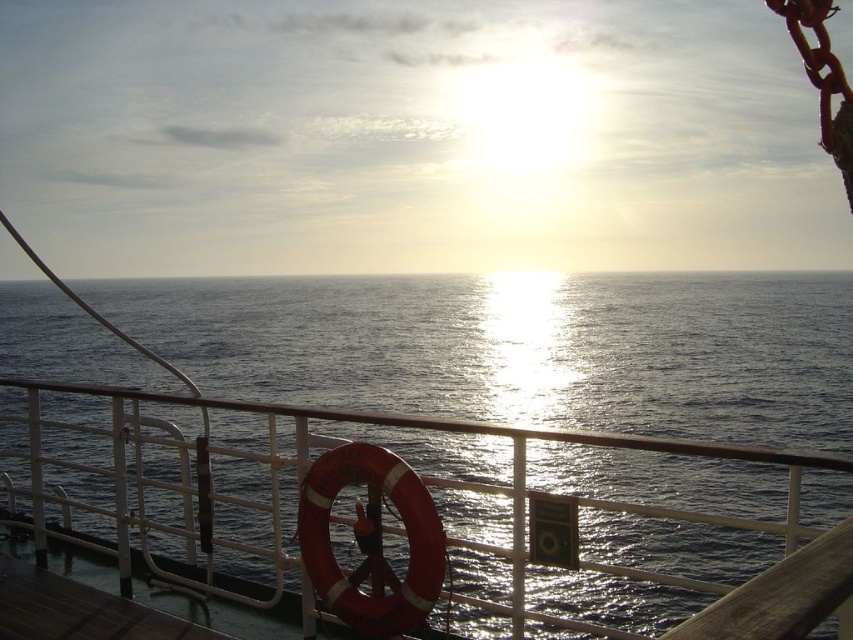
Question: From the image, what is the correct spatial relationship of glistening water at center in relation to brown wooden deck at lower left?

Choices:
 (A) right
 (B) left

Answer: (A)

Question: Which object appears farthest from the camera in this image?

Choices:
 (A) brown wooden deck at lower left
 (B) glistening water at center

Answer: (A)

Question: Does glistening water at center appear on the right side of brown wooden deck at lower left?

Choices:
 (A) no
 (B) yes

Answer: (B)

Question: Which point is farther from the camera taking this photo?

Choices:
 (A) (68, 584)
 (B) (508, 412)

Answer: (B)

Question: Does glistening water at center appear on the right side of brown wooden deck at lower left?

Choices:
 (A) yes
 (B) no

Answer: (A)

Question: Which object appears farthest from the camera in this image?

Choices:
 (A) brown wooden deck at lower left
 (B) glistening water at center

Answer: (A)